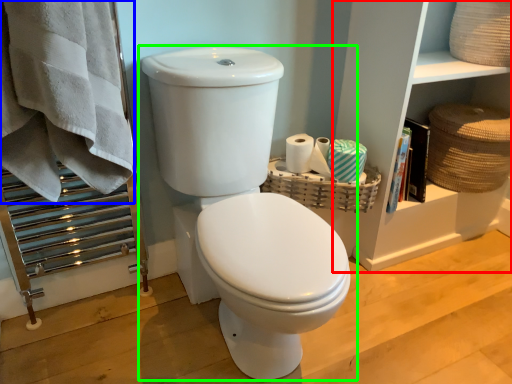
Question: Which object is positioned closest to shelf (highlighted by a red box)? Select from bath towel (highlighted by a blue box) and toilet (highlighted by a green box).

Choices:
 (A) bath towel
 (B) toilet

Answer: (B)